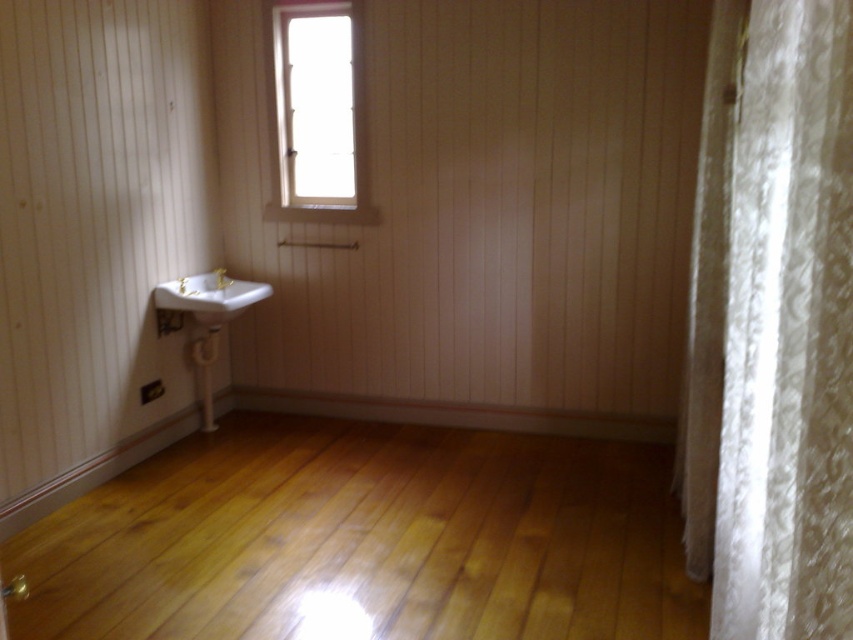
Question: Among these objects, which one is farthest from the camera?

Choices:
 (A) gold metallic faucet at left
 (B) white textured curtain at right

Answer: (A)

Question: From the image, what is the correct spatial relationship of shiny wood floor at lower center in relation to white textured curtain at right?

Choices:
 (A) below
 (B) above

Answer: (A)

Question: Is transparent glass window at upper center closer to the viewer compared to white textured curtain at right?

Choices:
 (A) yes
 (B) no

Answer: (B)

Question: Among these objects, which one is nearest to the camera?

Choices:
 (A) matte gold faucet at lower left
 (B) shiny wood floor at lower center
 (C) white lace curtain at right

Answer: (C)

Question: Does white glossy sink at lower left appear on the right side of matte gold faucet at lower left?

Choices:
 (A) yes
 (B) no

Answer: (A)

Question: Based on their relative distances, which object is nearer to the shiny wood floor at lower center?

Choices:
 (A) matte gold faucet at lower left
 (B) white textured curtain at right
 (C) gold metallic faucet at left
 (D) white glossy sink at lower left

Answer: (B)